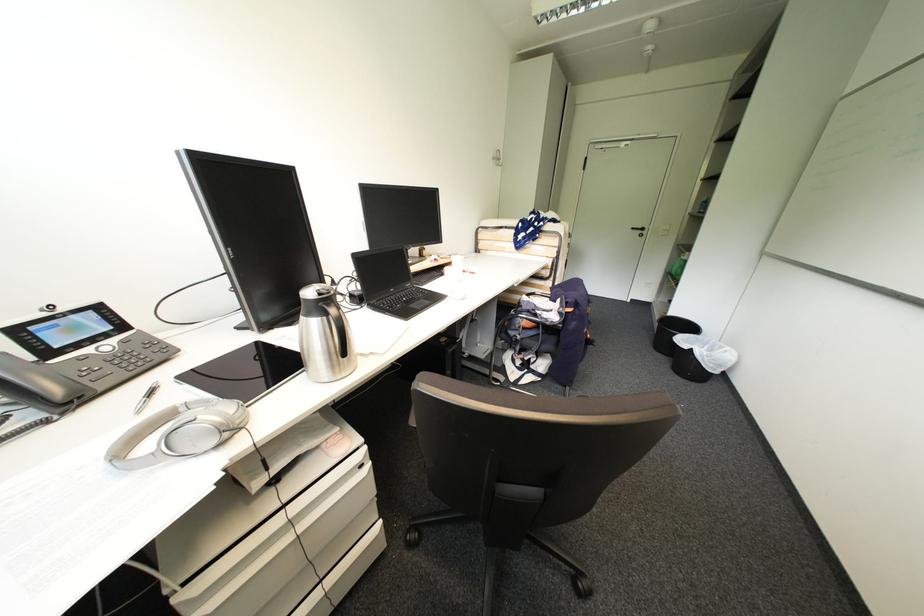
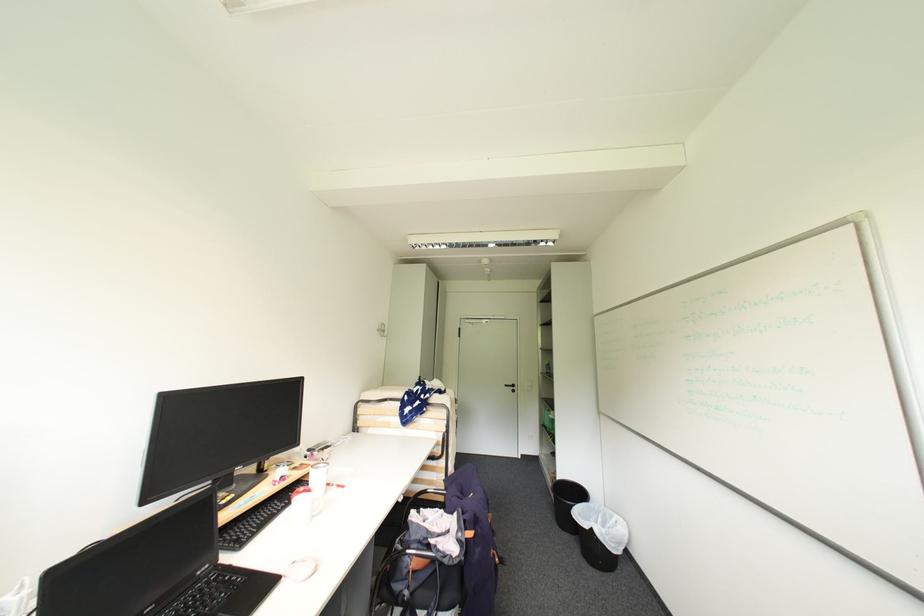
Where in the second image is the point corresponding to point 639,230 from the first image?

(513, 387)